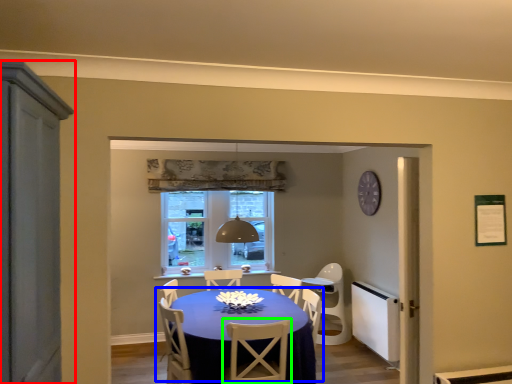
Question: Which is nearer to the cabinetry (highlighted by a red box)? kitchen & dining room table (highlighted by a blue box) or chair (highlighted by a green box).

Choices:
 (A) kitchen & dining room table
 (B) chair

Answer: (B)